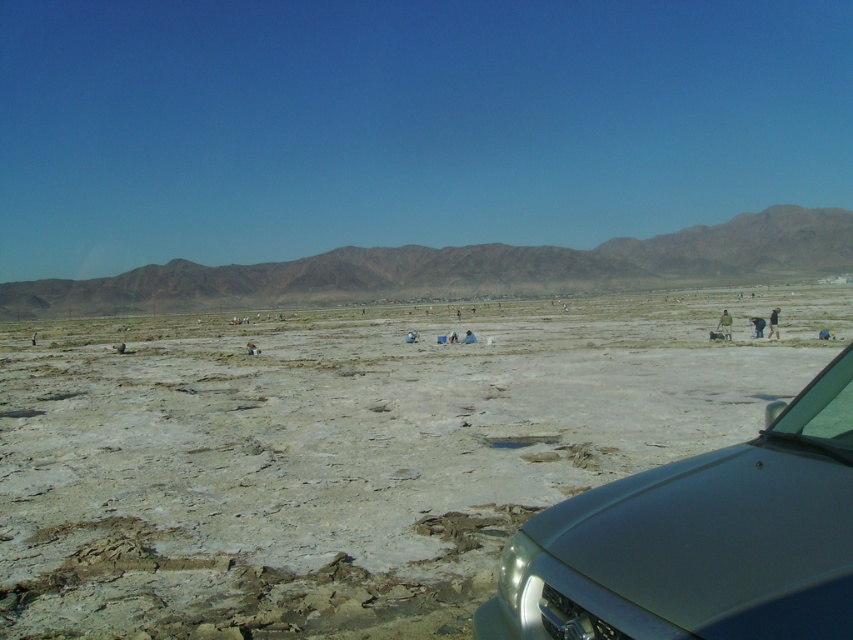
In the scene shown: You are standing at the origin point of this coordinate system and want to walk to the gray sandy dirt field at center. Which direction should you head towards?

The gray sandy dirt field at center is located at coordinate point 0.708 on the x axis and 0.407 on the y axis, so you should head towards the northeast direction to reach it.

You are a photographer planning to take a panoramic shot of the gray sandy dirt field at center and the satin silver car at lower right. Which object should you focus on first if you want to capture both in a single frame without moving the camera?

The gray sandy dirt field at center is wider than the satin silver car at lower right, so you should focus on the gray sandy dirt field at center first to ensure it fits within the frame.